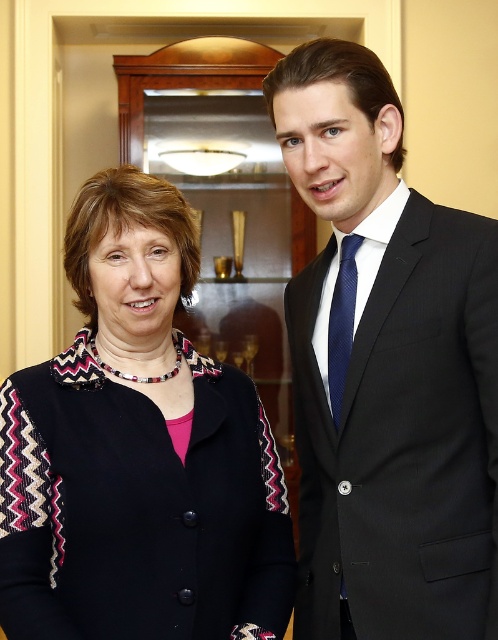
Question: Can you confirm if black suit at right is positioned above navy silk tie at right?

Choices:
 (A) no
 (B) yes

Answer: (A)

Question: Can you confirm if black suit at right is positioned below black knitted sweater at center?

Choices:
 (A) yes
 (B) no

Answer: (B)

Question: Estimate the real-world distances between objects in this image. Which object is closer to the navy silk tie at right?

Choices:
 (A) black suit at right
 (B) black knitted sweater at center

Answer: (A)

Question: Does black suit at right appear on the left side of black knitted sweater at center?

Choices:
 (A) yes
 (B) no

Answer: (B)

Question: Which of the following is the closest to the observer?

Choices:
 (A) black suit at right
 (B) navy silk tie at right

Answer: (A)

Question: Which object appears closest to the camera in this image?

Choices:
 (A) navy silk tie at right
 (B) black knitted sweater at center
 (C) black suit at right

Answer: (B)